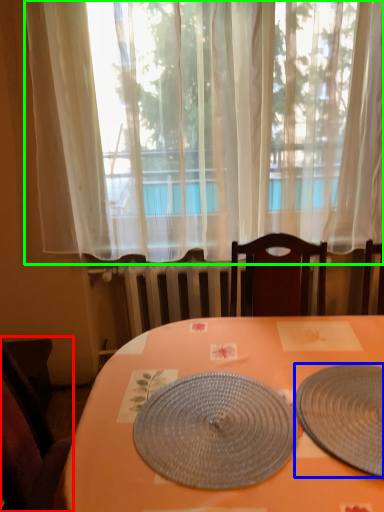
Question: Considering the real-world distances, which object is farthest from chair (highlighted by a red box)? plate (highlighted by a blue box) or curtain (highlighted by a green box)?

Choices:
 (A) plate
 (B) curtain

Answer: (B)